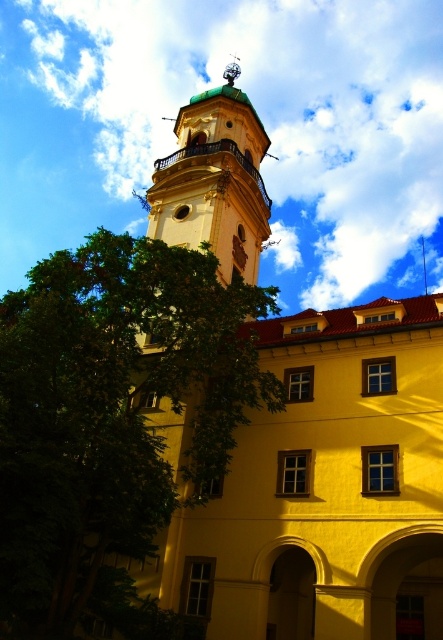
Based on the photo, which is above, green leafy tree at left or matte yellow bell tower at center?

Positioned higher is matte yellow bell tower at center.

Is green leafy tree at left above matte yellow bell tower at center?

No, green leafy tree at left is not above matte yellow bell tower at center.

Between point (198, 460) and point (213, 186), which one is positioned in front?

Point (198, 460) is more forward.

Find the location of a particular element. The height and width of the screenshot is (640, 443). green leafy tree at left is located at coordinates tap(112, 422).